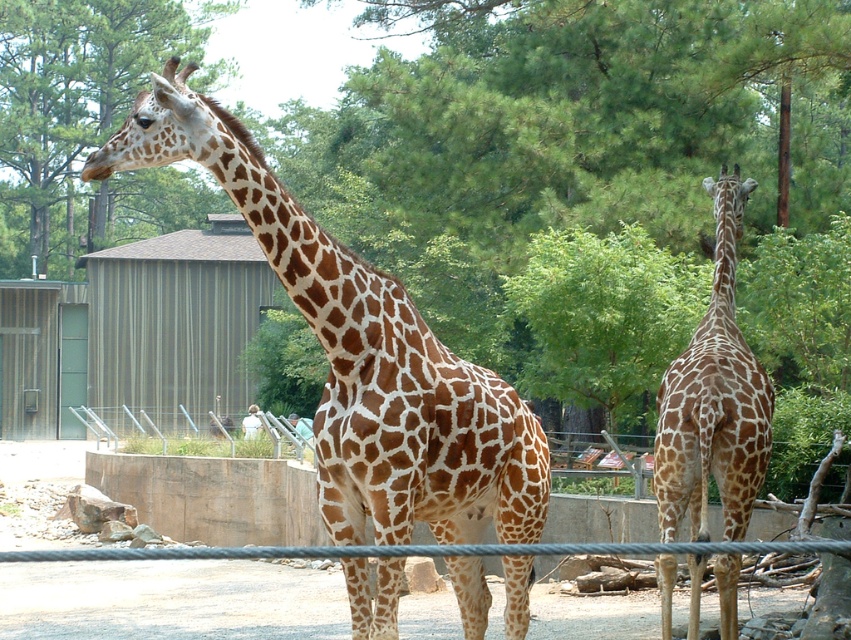
Question: Which object is closer to the camera taking this photo?

Choices:
 (A) brown spotted giraffe at right
 (B) green leafy tree at upper center
 (C) smooth white shirt at lower center
 (D) brown spotted giraffe at left

Answer: (D)

Question: Can you confirm if green leafy tree at upper center is smaller than smooth white shirt at lower center?

Choices:
 (A) no
 (B) yes

Answer: (A)

Question: Can you confirm if brown spotted giraffe at left is positioned below green leafy tree at upper center?

Choices:
 (A) yes
 (B) no

Answer: (A)

Question: Considering the relative positions of green leafy tree at upper center and smooth white shirt at lower center in the image provided, where is green leafy tree at upper center located with respect to smooth white shirt at lower center?

Choices:
 (A) above
 (B) below

Answer: (A)

Question: Based on their relative distances, which object is farther from the brown spotted giraffe at right?

Choices:
 (A) smooth white shirt at lower center
 (B) green leafy tree at upper center

Answer: (B)

Question: Among these points, which one is nearest to the camera?

Choices:
 (A) (464, 611)
 (B) (735, 429)
 (C) (275, 433)
 (D) (153, 35)

Answer: (A)